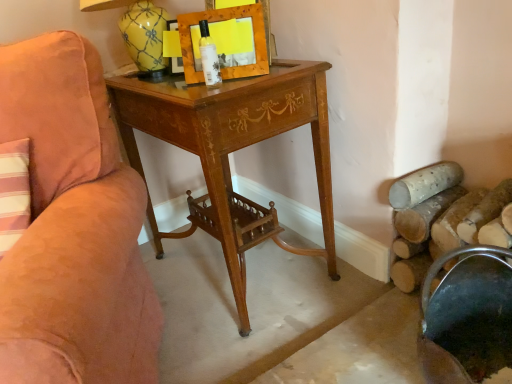
Question: Are wooden desk at center and suede-like peach chair at left beside each other?

Choices:
 (A) no
 (B) yes

Answer: (A)

Question: From the image's perspective, would you say wooden desk at center is shown under suede-like peach chair at left?

Choices:
 (A) yes
 (B) no

Answer: (B)

Question: From a real-world perspective, is wooden desk at center beneath suede-like peach chair at left?

Choices:
 (A) yes
 (B) no

Answer: (A)

Question: Is wooden desk at center shorter than suede-like peach chair at left?

Choices:
 (A) no
 (B) yes

Answer: (B)

Question: Considering the relative sizes of wooden desk at center and suede-like peach chair at left in the image provided, is wooden desk at center smaller than suede-like peach chair at left?

Choices:
 (A) yes
 (B) no

Answer: (A)

Question: Is wooden desk at center positioned beyond the bounds of suede-like peach chair at left?

Choices:
 (A) no
 (B) yes

Answer: (B)

Question: Can you confirm if wooden desk at center is taller than metallic dark green bucket at lower right?

Choices:
 (A) yes
 (B) no

Answer: (A)

Question: Is the depth of wooden desk at center greater than that of metallic dark green bucket at lower right?

Choices:
 (A) yes
 (B) no

Answer: (A)

Question: Is wooden desk at center wider than metallic dark green bucket at lower right?

Choices:
 (A) no
 (B) yes

Answer: (B)

Question: Is wooden desk at center far away from metallic dark green bucket at lower right?

Choices:
 (A) yes
 (B) no

Answer: (B)

Question: Can you confirm if wooden desk at center is positioned to the left of metallic dark green bucket at lower right?

Choices:
 (A) yes
 (B) no

Answer: (A)

Question: From the image's perspective, would you say wooden desk at center is shown under metallic dark green bucket at lower right?

Choices:
 (A) yes
 (B) no

Answer: (B)

Question: Can wooden picture frame at upper center be found inside metallic dark green bucket at lower right?

Choices:
 (A) yes
 (B) no

Answer: (B)